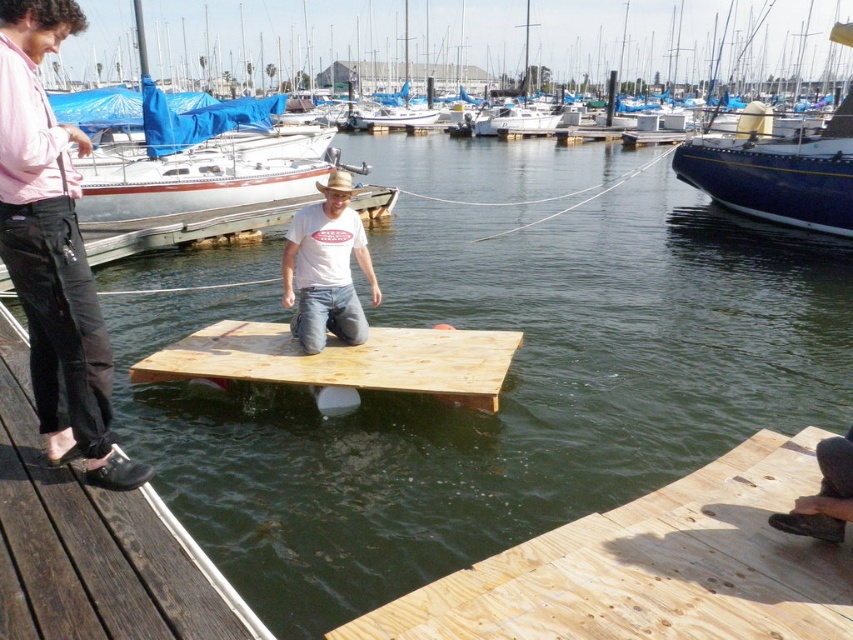
You are standing on the dock and want to jump into the water. The blue glossy sailboat at right is 11.88 meters away from you. If you jump straight ahead, will you land closer to the sailboat or further away?

The blue glossy sailboat at right is 11.88 meters away from you. If you jump straight ahead, you will land closer to the sailboat because the distance reduces as you move forward from the dock.

You are standing on the dock and want to jump into the water. The point where you want to land is at coordinates point (189, 624). If your diving board is 2 meters away from the camera, will you land at the desired point?

The distance of point (189, 624) from camera is 3.11 meters, so if your diving board is only 2 meters away from the camera, you will overshoot the desired landing point by 1.11 meters.